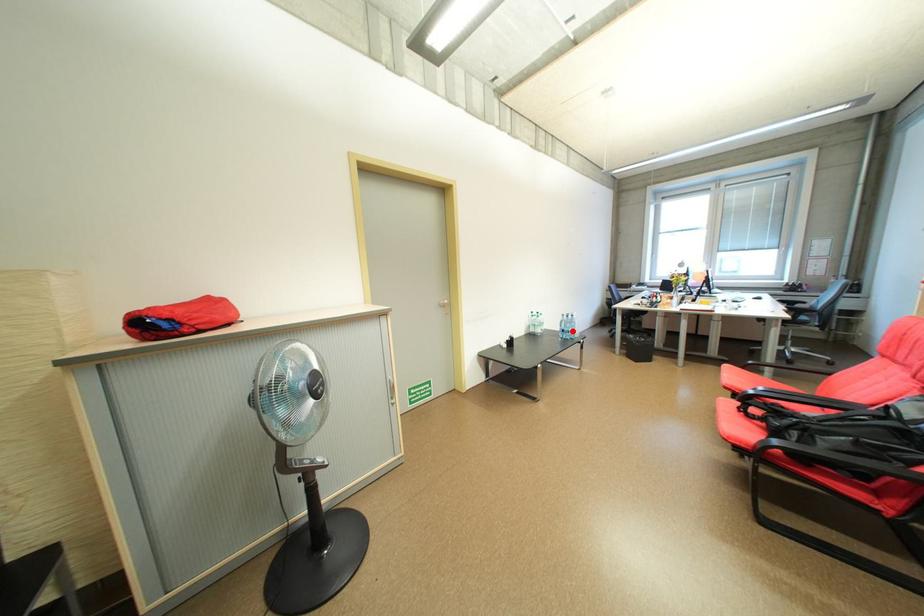
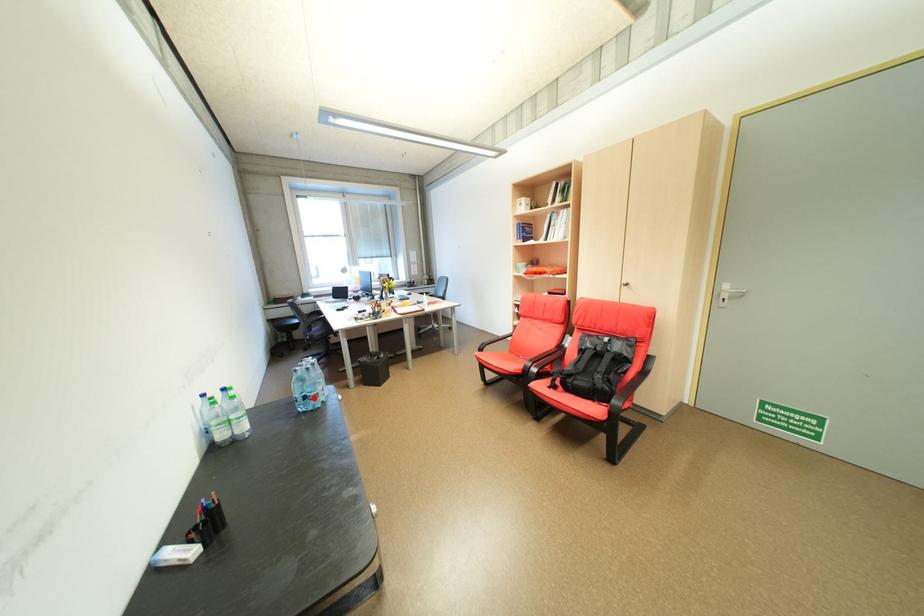
I am providing you with two images of the same scene from different viewpoints. A red point is marked on the first image and another point is marked on the second image. Does the point marked in image1 correspond to the same location as the one in image2?

Yes